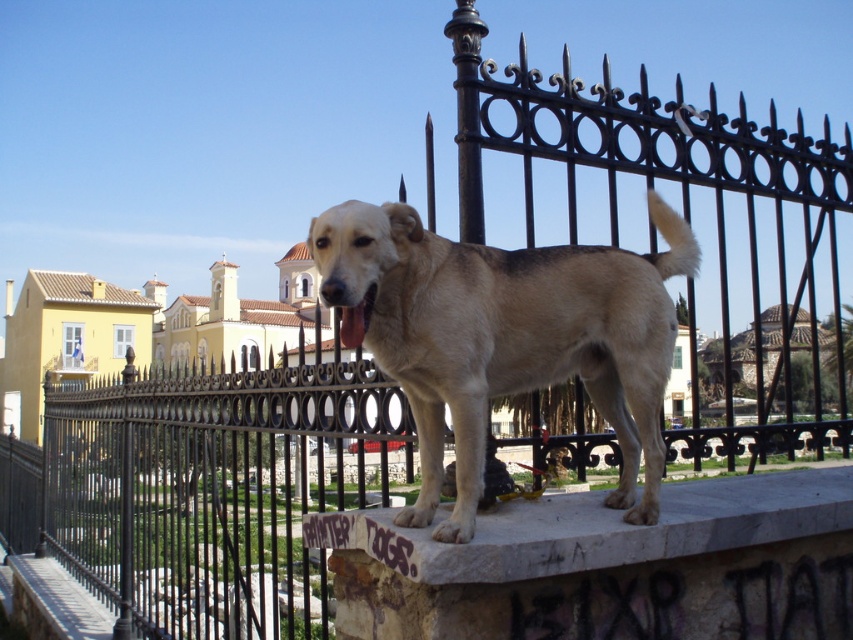
Question: Which object appears farthest from the camera in this image?

Choices:
 (A) light brown fur at center
 (B) pink glossy tongue at center

Answer: (B)

Question: Can you confirm if light brown fur at center is thinner than pink glossy tongue at center?

Choices:
 (A) no
 (B) yes

Answer: (A)

Question: Does marble ledge at center appear on the right side of pink glossy tongue at center?

Choices:
 (A) no
 (B) yes

Answer: (B)

Question: Which of the following is the farthest from the observer?

Choices:
 (A) (436, 364)
 (B) (344, 323)

Answer: (B)

Question: Can you confirm if light brown fur at center is positioned below pink glossy tongue at center?

Choices:
 (A) yes
 (B) no

Answer: (A)

Question: Estimate the real-world distances between objects in this image. Which object is farther from the pink glossy tongue at center?

Choices:
 (A) marble ledge at center
 (B) light brown fur at center

Answer: (A)